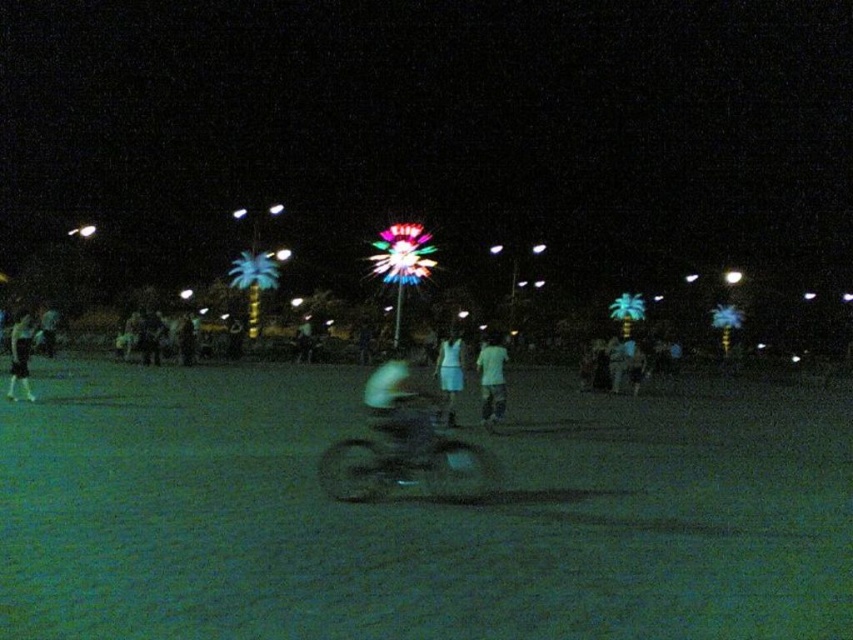
Is dark matte motorcycle at center further to camera compared to dark blue jeans at left?

No, it is in front of dark blue jeans at left.

Is point (401, 461) closer to camera compared to point (33, 394)?

Yes, point (401, 461) is closer to viewer.

What do you see at coordinates (405, 456) in the screenshot? I see `dark matte motorcycle at center` at bounding box center [405, 456].

Locate an element on the screen. The height and width of the screenshot is (640, 853). dark matte motorcycle at center is located at coordinates (405, 456).

Can you confirm if white matte dress at center is smaller than dark blue jeans at left?

Indeed, white matte dress at center has a smaller size compared to dark blue jeans at left.

Locate an element on the screen. This screenshot has width=853, height=640. white matte dress at center is located at coordinates (450, 374).

Does white matte shirt at center have a lesser height compared to white matte dress at center?

Correct, white matte shirt at center is not as tall as white matte dress at center.

Describe the element at coordinates (491, 380) in the screenshot. I see `white matte shirt at center` at that location.

This screenshot has width=853, height=640. Identify the location of white matte shirt at center. (491, 380).